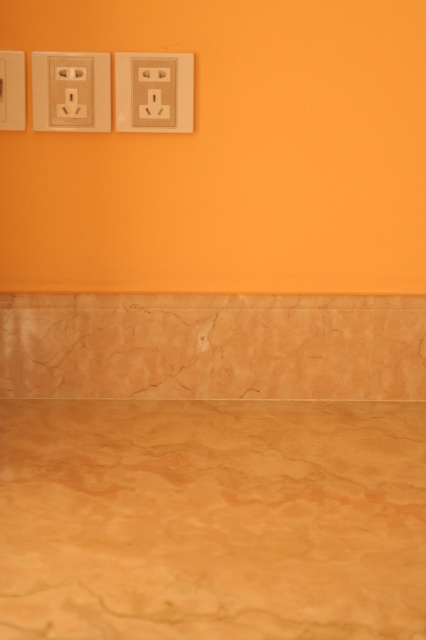
You are trying to place a decorative plate on the wall between the marble countertop at lower center and the beige plastic outlet at upper center. Which object should you place the plate closer to if you want it to be more visible?

The marble countertop at lower center is larger in size than the beige plastic outlet at upper center, so placing the decorative plate closer to the marble countertop at lower center would make it more visible due to its larger surface area.

You are an electrician trying to install a new outlet between the existing ones. The new outlet must be placed exactly halfway between the beige plastic outlet at upper left and the beige plastic outlet at upper center. Can you determine the position where the new outlet should be placed?

The new outlet should be placed between the beige plastic outlet at upper left and the beige plastic outlet at upper center, exactly halfway between them.